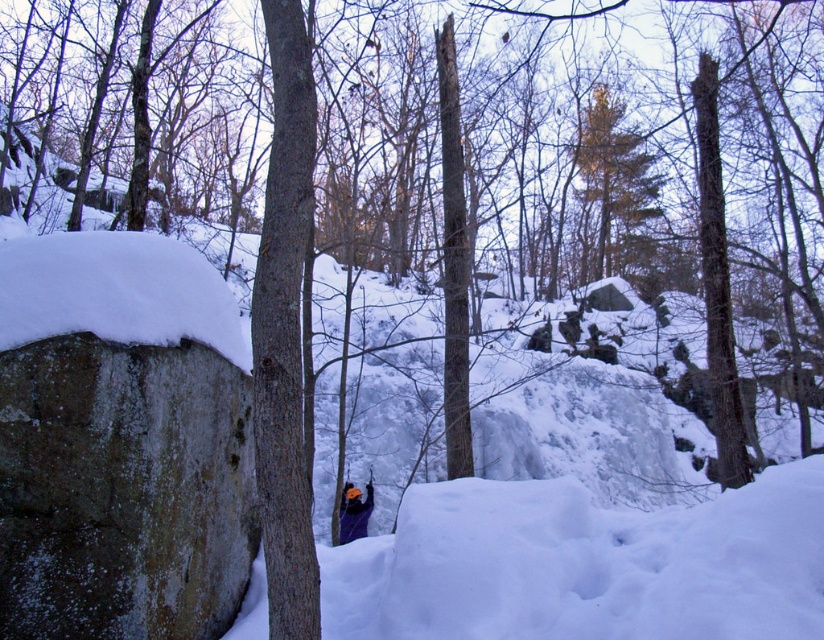
You are planning to place a 30 meter long safety rope between the speckled stone boulder at left and the brown textured tree at upper center. Will the rope be long enough to stretch between them?

The distance between the speckled stone boulder at left and the brown textured tree at upper center is 28.28 meters. Since the rope is 30 meters long, it will be long enough to stretch between them with some extra length remaining.

You are standing at the camera position and want to take a photo of the brown textured tree at upper center. The camera has a maximum focus range of 25 meters. Will the tree be in focus?

The brown textured tree at upper center is 26.81 meters from the camera, which exceeds the maximum focus range of 25 meters. Therefore, the tree will not be in focus.